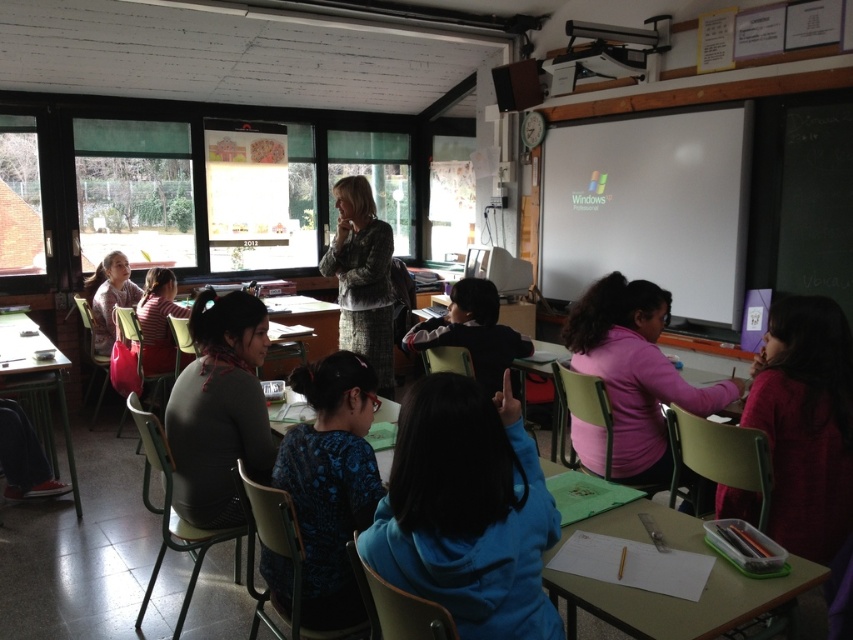
You are a student sitting in the classroom and want to reach both the point at (x=709, y=596) and the point at (x=346, y=324). Which point should you walk towards first to reach the closer one?

You should walk towards point (x=709, y=596) first because it is closer to you than point (x=346, y=324).

You are a student sitting at the back of the classroom. You need to pass a note to your friend who is sitting at the green plastic table at center. However, there is a patterned fabric jacket at center in the way. Based on their positions, can you reach the table without moving the jacket?

The green plastic table at center is closer to the viewer than the patterned fabric jacket at center. Since the table is closer, you can reach it without needing to move the jacket because it is in front of the jacket.

You are a student sitting at the desk in the back row of the classroom. The teacher is wearing a blue fabric shirt at center. Where is the teacher standing relative to your position?

The teacher wearing the blue fabric shirt at center is standing at the front of the classroom, so the teacher is in front of you.